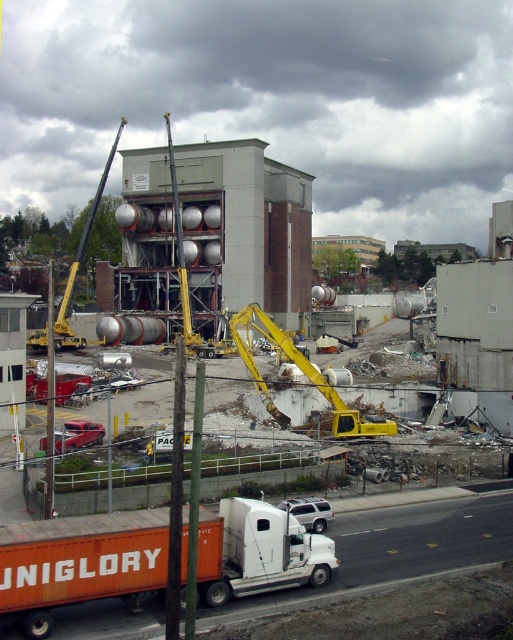
Question: Among these points, which one is farthest from the camera?

Choices:
 (A) (270, 524)
 (B) (286, 346)

Answer: (B)

Question: Which point is farther from the camera taking this photo?

Choices:
 (A) (317, 536)
 (B) (304, 372)

Answer: (B)

Question: Does orange matte trailer truck at lower left have a greater width compared to yellow metallic excavator at center?

Choices:
 (A) yes
 (B) no

Answer: (B)

Question: Which of the following is the closest to the observer?

Choices:
 (A) orange matte trailer truck at lower left
 (B) yellow metallic excavator at center

Answer: (A)

Question: Is orange matte trailer truck at lower left closer to the viewer compared to yellow metallic excavator at center?

Choices:
 (A) no
 (B) yes

Answer: (B)

Question: Can you confirm if orange matte trailer truck at lower left is smaller than yellow metallic excavator at center?

Choices:
 (A) no
 (B) yes

Answer: (B)